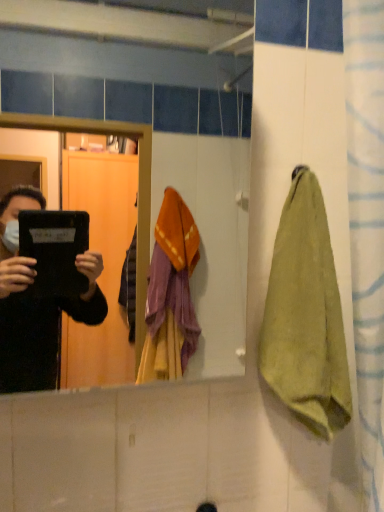
Measure the distance between point (299,215) and camera.

The distance of point (299,215) from camera is 35.83 inches.

This screenshot has width=384, height=512. Describe the element at coordinates (306, 315) in the screenshot. I see `green cotton towel at right` at that location.

Locate an element on the screen. This screenshot has width=384, height=512. green cotton towel at right is located at coordinates (306, 315).

This screenshot has height=512, width=384. Identify the location of matte black tablet at center. (133, 68).

The height and width of the screenshot is (512, 384). What do you see at coordinates (133, 68) in the screenshot? I see `matte black tablet at center` at bounding box center [133, 68].

Measure the distance between point (231, 355) and camera.

2.06 meters.

This screenshot has width=384, height=512. In order to click on green cotton towel at right in this screenshot , I will do `click(306, 315)`.

Looking at this image, considering the relative positions of green cotton towel at right and matte black tablet at center in the image provided, is green cotton towel at right to the left of matte black tablet at center from the viewer's perspective?

No.

In the scene shown: In the image, is green cotton towel at right positioned in front of or behind matte black tablet at center?

green cotton towel at right is behind matte black tablet at center.

Does point (296, 366) come in front of point (133, 18)?

Yes, it is.

From the image's perspective, which is above, green cotton towel at right or matte black tablet at center?

matte black tablet at center.

From a real-world perspective, is green cotton towel at right positioned above or below matte black tablet at center?

In terms of real-world spatial position, green cotton towel at right is below matte black tablet at center.

Is green cotton towel at right thinner than matte black tablet at center?

Indeed, green cotton towel at right has a lesser width compared to matte black tablet at center.

Considering the relative sizes of green cotton towel at right and matte black tablet at center in the image provided, is green cotton towel at right taller than matte black tablet at center?

Incorrect, the height of green cotton towel at right is not larger of that of matte black tablet at center.

Who is bigger, green cotton towel at right or matte black tablet at center?

Bigger between the two is matte black tablet at center.

Is green cotton towel at right located outside matte black tablet at center?

Yes.

Consider the image. Are green cotton towel at right and matte black tablet at center far apart?

No, green cotton towel at right is not far away from matte black tablet at center.

Is green cotton towel at right positioned with its back to matte black tablet at center?

No, green cotton towel at right's orientation is not away from matte black tablet at center.

What's the angular difference between green cotton towel at right and matte black tablet at center's facing directions?

0.000528 degrees separate the facing orientations of green cotton towel at right and matte black tablet at center.

The height and width of the screenshot is (512, 384). Identify the location of towel/napkin below the matte black tablet at center (from the image's perspective). (306, 315).

Which object is positioned more to the right, matte black tablet at center or green cotton towel at right?

From the viewer's perspective, green cotton towel at right appears more on the right side.

In the scene shown: Who is more distant, matte black tablet at center or green cotton towel at right?

green cotton towel at right is further away from the camera.

Which is in front, point (172, 110) or point (298, 253)?

The point (298, 253) is in front.

From the image's perspective, relative to green cotton towel at right, is matte black tablet at center above or below?

Clearly, from the image's perspective, matte black tablet at center is above green cotton towel at right.

From a real-world perspective, who is located higher, matte black tablet at center or green cotton towel at right?

matte black tablet at center, from a real-world perspective.

Which object is wider, matte black tablet at center or green cotton towel at right?

matte black tablet at center.

Considering the relative sizes of matte black tablet at center and green cotton towel at right in the image provided, is matte black tablet at center shorter than green cotton towel at right?

No, matte black tablet at center is not shorter than green cotton towel at right.

Is matte black tablet at center smaller than green cotton towel at right?

Actually, matte black tablet at center might be larger than green cotton towel at right.

Is matte black tablet at center situated inside green cotton towel at right or outside?

matte black tablet at center is not enclosed by green cotton towel at right.

Are matte black tablet at center and green cotton towel at right located far from each other?

That's not correct — matte black tablet at center is a little close to green cotton towel at right.

Could you tell me if matte black tablet at center is turned towards green cotton towel at right?

No, matte black tablet at center is not turned towards green cotton towel at right.

How different are the orientations of matte black tablet at center and green cotton towel at right in degrees?

The angle between the facing direction of matte black tablet at center and the facing direction of green cotton towel at right is 0.000528 degrees.

Measure the distance between matte black tablet at center and green cotton towel at right.

38.42 inches.

In order to click on towel/napkin that appears behind the matte black tablet at center in this screenshot , I will do `click(306, 315)`.

You are a GUI agent. You are given a task and a screenshot of the screen. Output one action in this format:
    pyautogui.click(x=<x>, y=<y>)
    Task: Click on the towel/napkin below the matte black tablet at center (from the image's perspective)
    
    Given the screenshot: What is the action you would take?
    pyautogui.click(x=306, y=315)

Where is `mirror located above the green cotton towel at right (from the image's perspective)`? mirror located above the green cotton towel at right (from the image's perspective) is located at coordinates (133, 68).